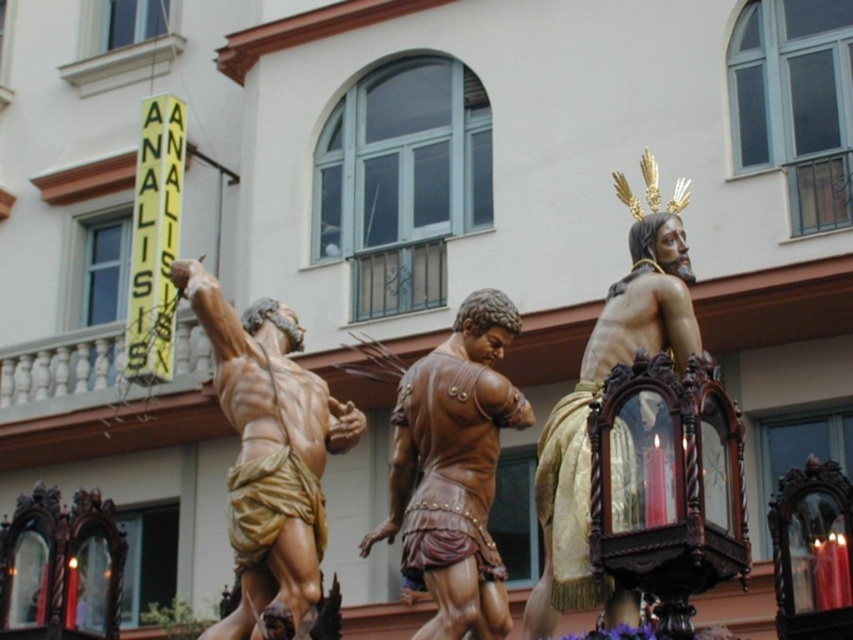
You are standing in front of the statues and want to place a small offering at the base of the matte gold statue at center. Based on its coordinates, where should you walk to? Please provide the coordinates in the format of a point like this example format, point 0.713, 0.317.

The matte gold statue at center is located at point (270,456), so you should walk to point (270,456) to place your offering.

You are standing at the entrance of the building and see the matte gold statue at center and the brown polished wood statue at center. If you want to visit both statues, which one should you approach first to minimize the distance you walk?

You should approach the matte gold statue at center first because it is closer to the entrance than the brown polished wood statue at center, so visiting it first would minimize the total distance walked.